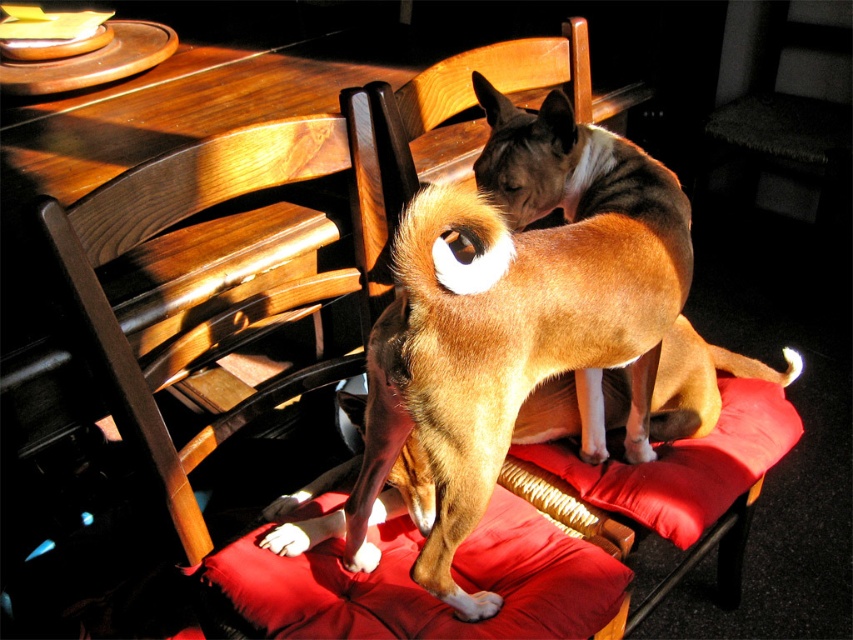
Question: Can you confirm if brown fur dog at center is positioned to the left of velvet red cushion at center?

Choices:
 (A) no
 (B) yes

Answer: (A)

Question: Which of the following is the closest to the observer?

Choices:
 (A) velvet red cushion at center
 (B) brown fur dog at center

Answer: (B)

Question: Which point appears farthest from the camera in this image?

Choices:
 (A) (532, 328)
 (B) (590, 616)

Answer: (B)

Question: Does brown fur dog at center have a smaller size compared to velvet red cushion at center?

Choices:
 (A) no
 (B) yes

Answer: (A)

Question: Can you confirm if brown fur dog at center is positioned to the right of velvet red cushion at center?

Choices:
 (A) no
 (B) yes

Answer: (B)

Question: Which of the following is the closest to the observer?

Choices:
 (A) (287, 506)
 (B) (506, 518)

Answer: (B)